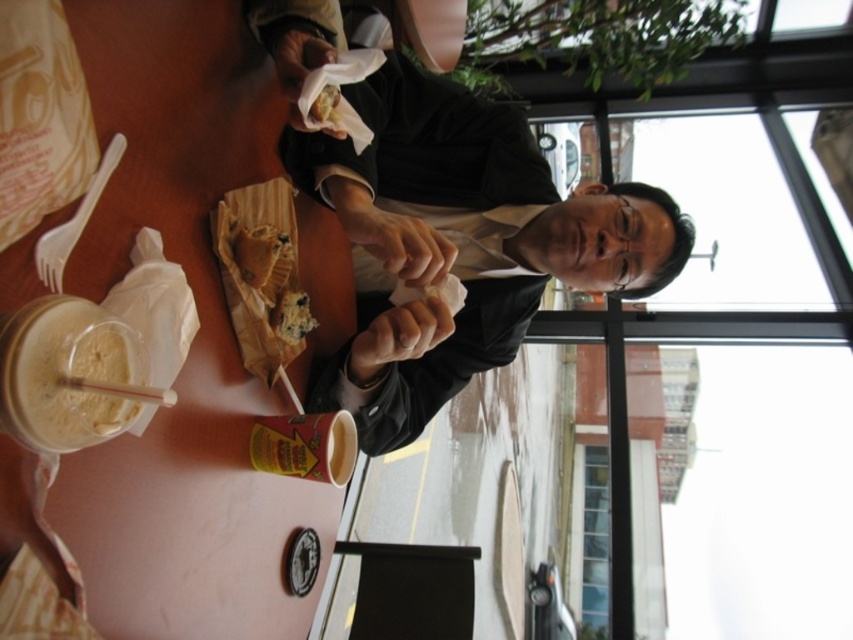
Which is in front, point (224, 8) or point (265, 259)?

Point (265, 259) is more forward.

In the scene shown: Is smooth brown table at center taller than chocolate chip muffin at center?

Yes, smooth brown table at center is taller than chocolate chip muffin at center.

Is point (166, 484) positioned after point (267, 257)?

No, it is in front of (267, 257).

Identify the location of smooth brown table at center. The width and height of the screenshot is (853, 640). (189, 349).

Between matte black jacket at center and chocolate chip cookie at center, which one appears on the right side from the viewer's perspective?

From the viewer's perspective, matte black jacket at center appears more on the right side.

Who is more forward, [357,252] or [279,323]?

Point [279,323] is in front.

Between point (440, 394) and point (306, 320), which one is positioned behind?

The point (440, 394) is more distant.

At what (x,y) coordinates should I click in order to perform the action: click on matte black jacket at center. Please return your answer as a coordinate pair (x, y). This screenshot has height=640, width=853. Looking at the image, I should click on (459, 241).

Who is higher up, chocolate chip muffin at center or chocolate chip cookie at center?

Positioned higher is chocolate chip muffin at center.

Which is below, chocolate chip muffin at center or chocolate chip cookie at center?

Positioned lower is chocolate chip cookie at center.

Locate an element on the screen. This screenshot has height=640, width=853. chocolate chip muffin at center is located at coordinates (257, 252).

Locate an element on the screen. The height and width of the screenshot is (640, 853). chocolate chip muffin at center is located at coordinates (257, 252).